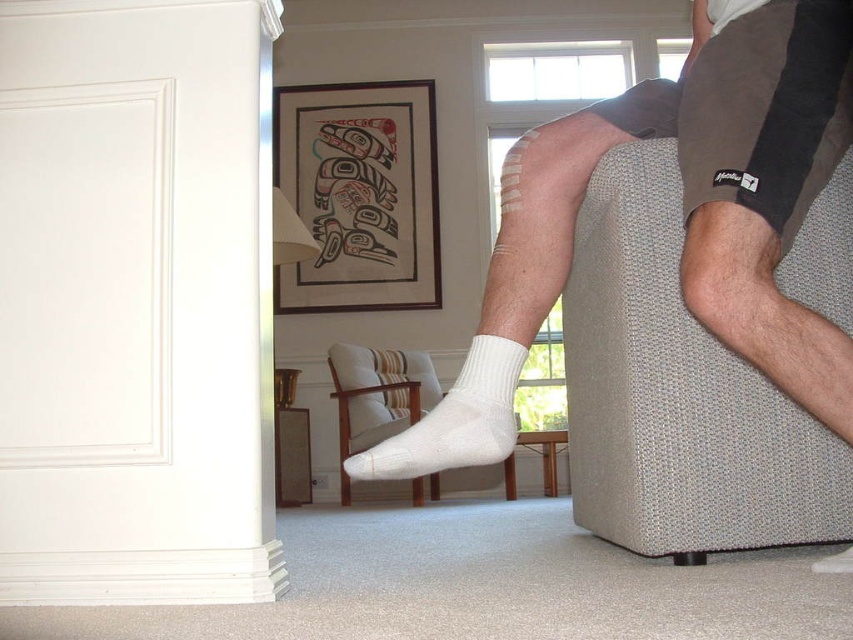
Question: Is light brown wood armchair at center thinner than white cotton sock at lower center?

Choices:
 (A) yes
 (B) no

Answer: (B)

Question: Which of the following is the closest to the observer?

Choices:
 (A) (610, 534)
 (B) (386, 403)
 (C) (483, 438)

Answer: (C)

Question: Does textured beige armchair at right have a lesser width compared to light brown wood armchair at center?

Choices:
 (A) no
 (B) yes

Answer: (B)

Question: Is white cotton socks at center positioned at the back of white cotton sock at lower center?

Choices:
 (A) no
 (B) yes

Answer: (B)

Question: Which of these objects is positioned closest to the light brown wood armchair at center?

Choices:
 (A) textured beige armchair at right
 (B) white cotton sock at lower center

Answer: (A)

Question: Which point is closer to the camera?

Choices:
 (A) white cotton socks at center
 (B) white painted wood at left

Answer: (B)